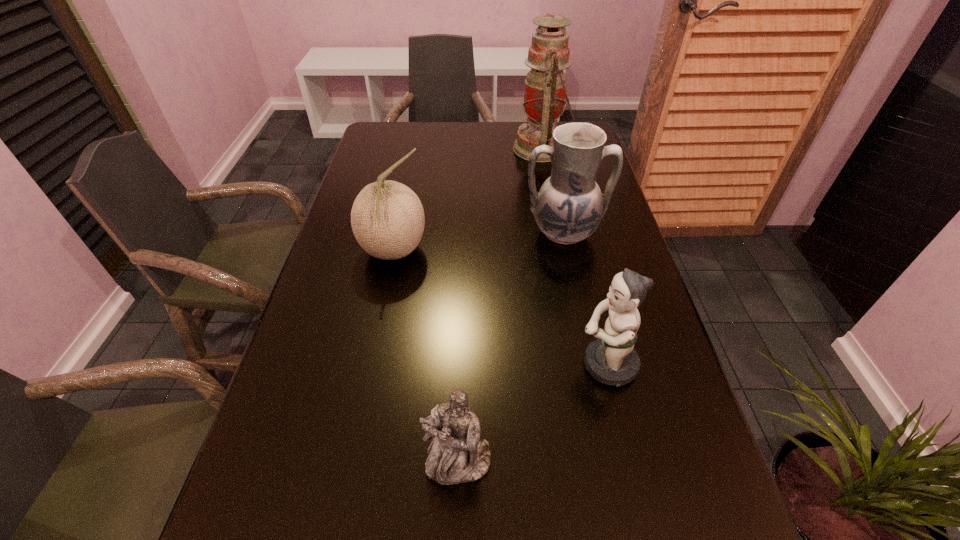
This screenshot has width=960, height=540. Identify the location of the tallest object. point(545,91).

In order to click on the farthest object in this screenshot , I will do `click(545, 91)`.

Find the location of a particular element. The image size is (960, 540). pitcher is located at coordinates (569, 206).

Locate an element on the screen. Image resolution: width=960 pixels, height=540 pixels. the leftmost object is located at coordinates pyautogui.click(x=387, y=218).

Where is `the farther figurine`? The height and width of the screenshot is (540, 960). the farther figurine is located at coordinates (611, 359).

Identify the location of the right figurine. This screenshot has width=960, height=540. (611, 359).

Where is `the shorter figurine`? the shorter figurine is located at coordinates (456, 455).

You are a GUI agent. You are given a task and a screenshot of the screen. Output one action in this format:
    pyautogui.click(x=<x>, y=<y>)
    Task: Click on the nearest object
    
    Given the screenshot: What is the action you would take?
    pyautogui.click(x=456, y=455)

Where is `vacant region located 0.080m on the back of the farthest object`? vacant region located 0.080m on the back of the farthest object is located at coordinates [x=537, y=120].

Find the location of a particular element. Image resolution: width=960 pixels, height=540 pixels. free space located 0.260m on the front-facing side of the pitcher is located at coordinates (585, 335).